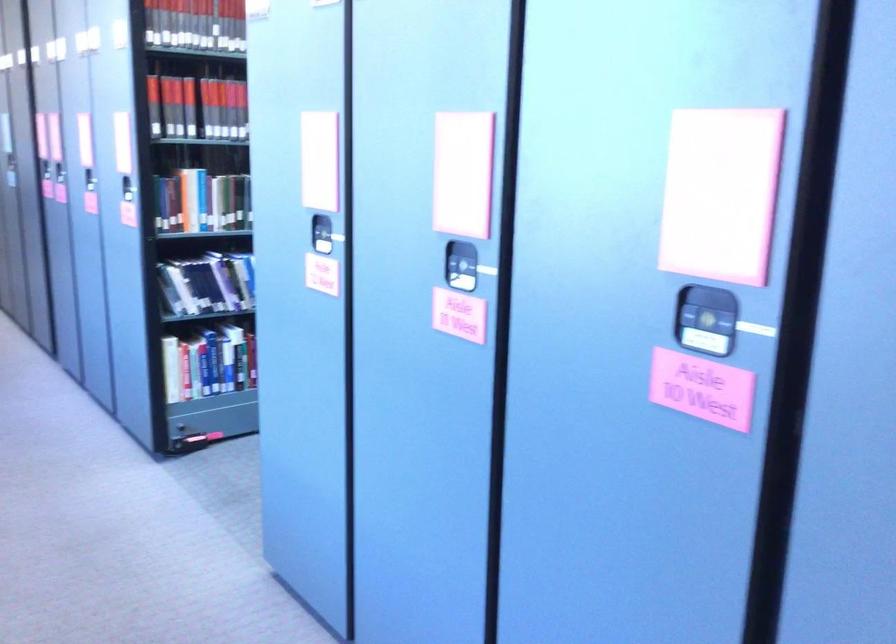
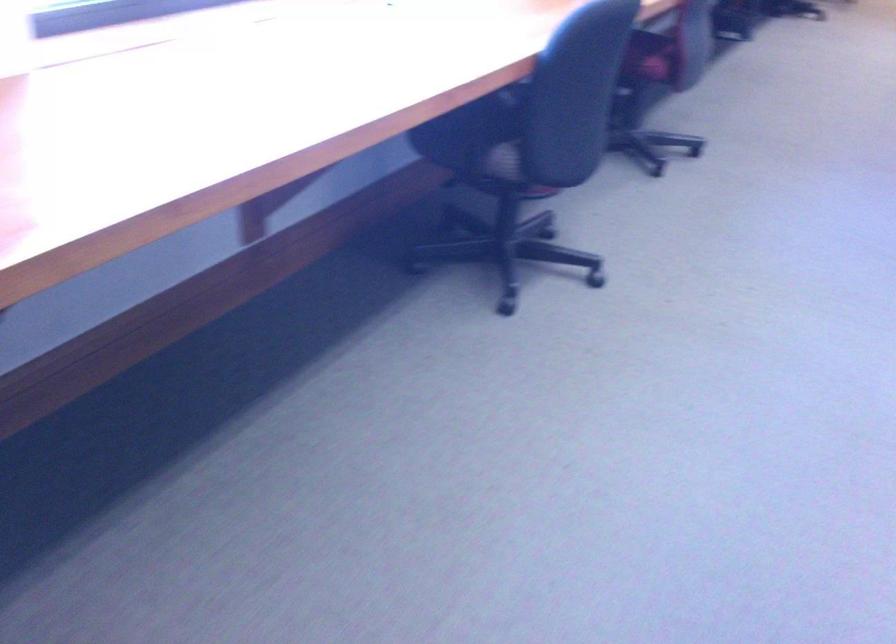
In the scene shown: First-person continuous shooting, in which direction is the camera rotating?

The rotation direction of the camera is left-down.